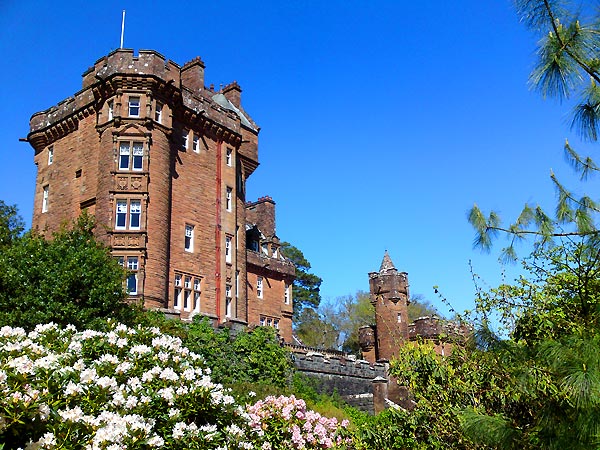
Where is `corner windows`? Image resolution: width=600 pixels, height=450 pixels. corner windows is located at coordinates point(131,105), point(124,156), point(120,212), point(123,280).